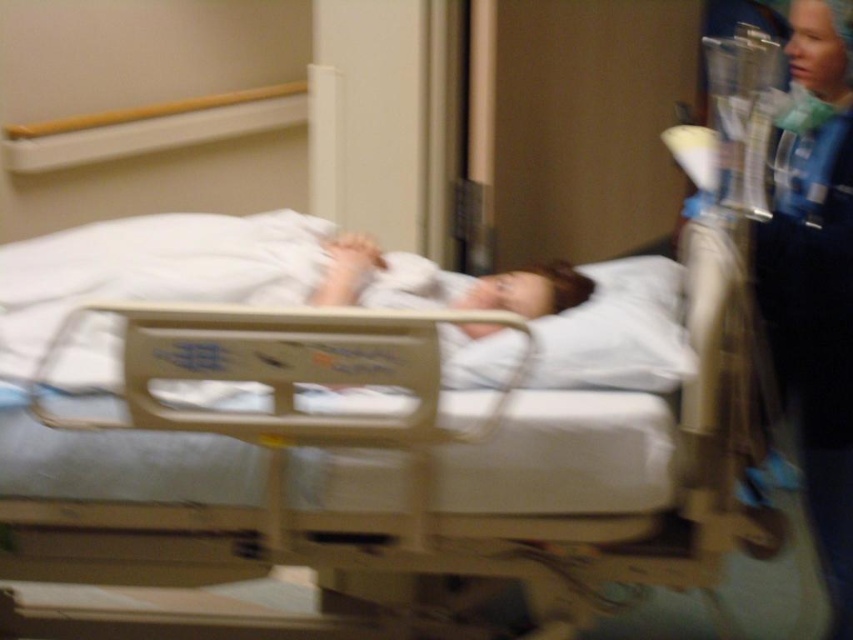
Question: Does beige plastic hospital bed at center lie in front of blue scrubs at right?

Choices:
 (A) no
 (B) yes

Answer: (B)

Question: Is beige plastic hospital bed at center bigger than blue scrubs at right?

Choices:
 (A) yes
 (B) no

Answer: (A)

Question: Can you confirm if beige plastic hospital bed at center is thinner than blue scrubs at right?

Choices:
 (A) yes
 (B) no

Answer: (B)